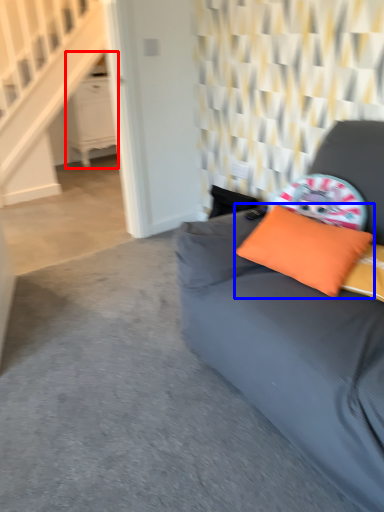
Question: Among these objects, which one is nearest to the camera, dresser (highlighted by a red box) or pillow (highlighted by a blue box)?

Choices:
 (A) dresser
 (B) pillow

Answer: (B)